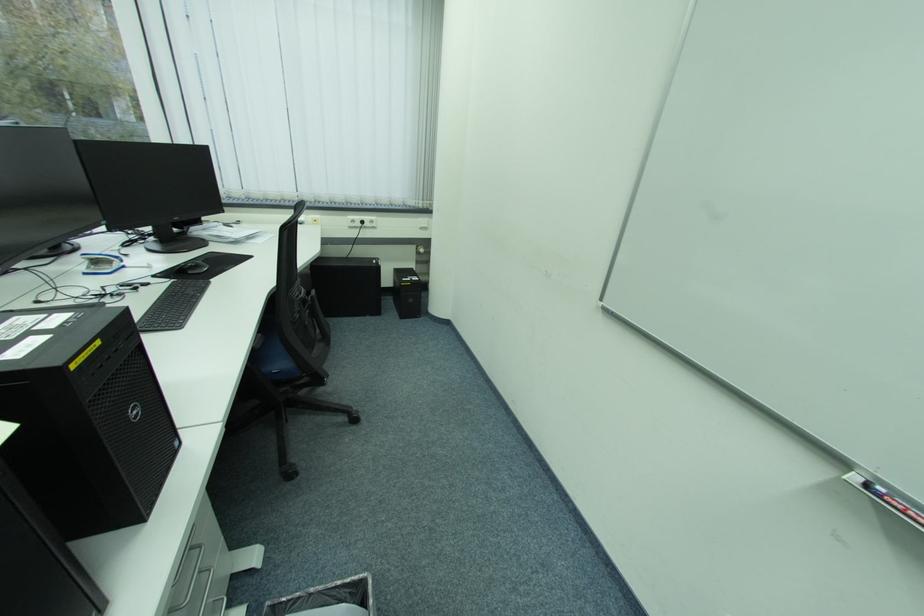
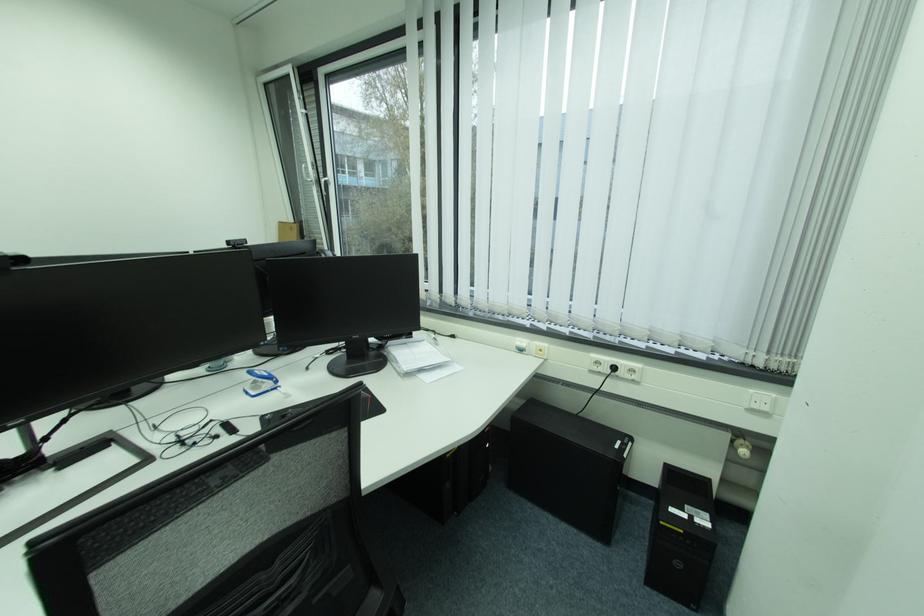
In the second image, find the point that corresponds to point (360, 222) in the first image.

(605, 363)